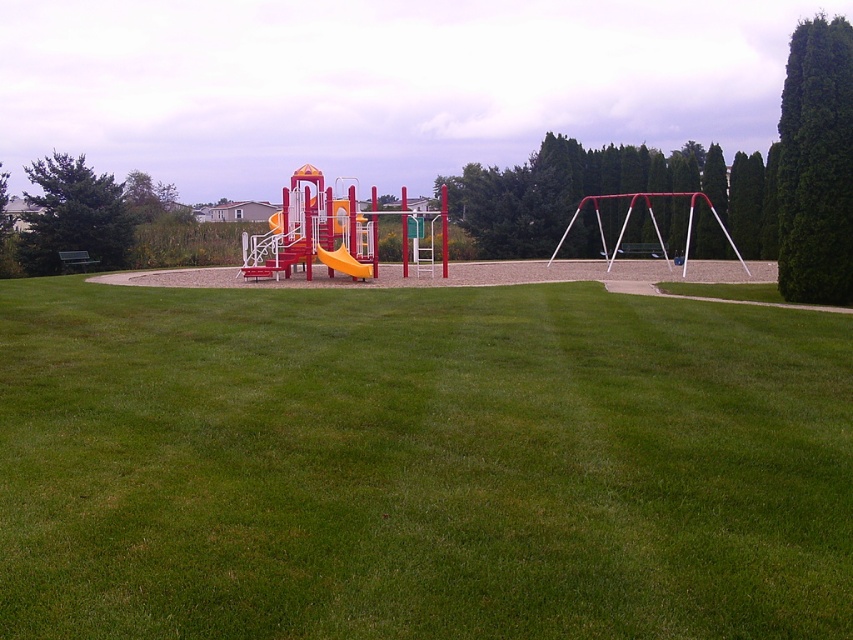
Question: Does green leafy cypress tree at left come in front of orange matte slide at center?

Choices:
 (A) no
 (B) yes

Answer: (A)

Question: Estimate the real-world distances between objects in this image. Which object is farther from the green leafy cypress at upper right?

Choices:
 (A) orange matte slide at center
 (B) green grassy field at center
 (C) green leafy cypress tree at left

Answer: (C)

Question: Is green grassy field at center wider than green leafy cypress at upper right?

Choices:
 (A) yes
 (B) no

Answer: (A)

Question: Which object is the farthest from the green leafy cypress at upper right?

Choices:
 (A) orange matte slide at center
 (B) green grassy field at center

Answer: (A)

Question: Does green leafy cypress tree at left have a lesser width compared to orange matte slide at center?

Choices:
 (A) yes
 (B) no

Answer: (B)

Question: Which point appears closest to the camera in this image?

Choices:
 (A) (24, 266)
 (B) (798, 163)
 (C) (351, 269)

Answer: (B)